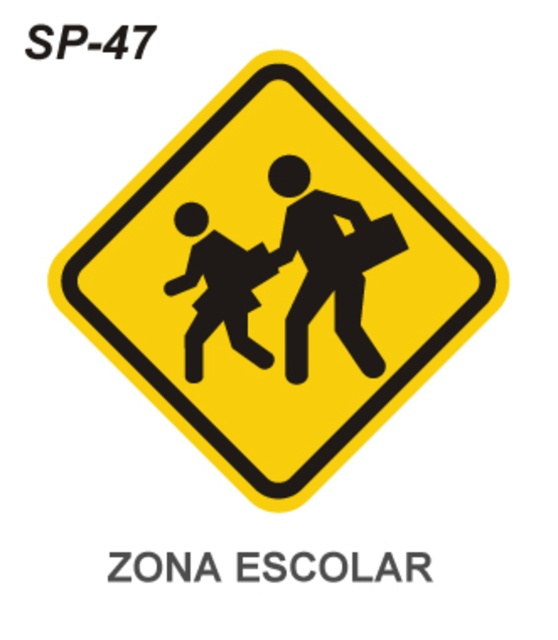
Does yellow matte sign at center appear on the right side of black silhouette at lower left?

Correct, you'll find yellow matte sign at center to the right of black silhouette at lower left.

Between yellow matte sign at center and black silhouette at lower left, which one is positioned lower?

black silhouette at lower left is below.

This screenshot has height=640, width=558. Identify the location of yellow matte sign at center. (277, 280).

Can you confirm if black silhouette at center is positioned to the right of black silhouette at lower left?

Correct, you'll find black silhouette at center to the right of black silhouette at lower left.

Between black silhouette at center and black silhouette at lower left, which one has less height?

black silhouette at lower left is shorter.

You are a GUI agent. You are given a task and a screenshot of the screen. Output one action in this format:
    pyautogui.click(x=<x>, y=<y>)
    Task: Click on the black silhouette at center
    The height and width of the screenshot is (640, 558).
    Given the screenshot: What is the action you would take?
    pyautogui.click(x=333, y=273)

Locate an element on the screen. This screenshot has width=558, height=640. black silhouette at center is located at coordinates (333, 273).

Between yellow matte sign at center and black silhouette at center, which one is positioned lower?

yellow matte sign at center is lower down.

Does yellow matte sign at center have a greater height compared to black silhouette at center?

Indeed, yellow matte sign at center has a greater height compared to black silhouette at center.

Measure the distance between yellow matte sign at center and camera.

A distance of 1.45 meters exists between yellow matte sign at center and camera.

The width and height of the screenshot is (558, 640). Identify the location of yellow matte sign at center. (277, 280).